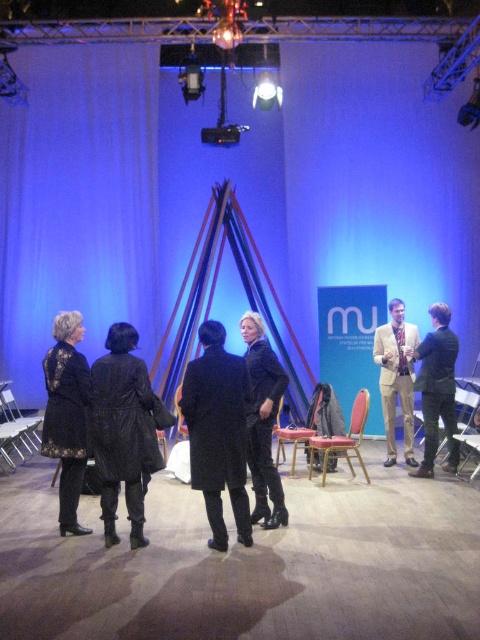
Question: Which of the following is the closest to the observer?

Choices:
 (A) metallic gold chair at center
 (B) black wool coat at center

Answer: (B)

Question: Does green fabric suit at right have a larger size compared to black leather chair at center?

Choices:
 (A) yes
 (B) no

Answer: (A)

Question: Considering the real-world distances, which object is farthest from the black wool coat at center?

Choices:
 (A) black lace coat at left
 (B) metallic silver chair at lower left
 (C) wooden chair at center
 (D) black leather chair at center

Answer: (B)

Question: Which point is farther to the camera?

Choices:
 (A) tan fabric suit at right
 (B) black lace coat at left
 (C) metallic gold chair at center
 (D) black wool coat at center

Answer: (A)

Question: Is tan fabric suit at right thinner than wooden chair at center?

Choices:
 (A) no
 (B) yes

Answer: (A)

Question: Is tan fabric suit at right positioned before black leather chair at center?

Choices:
 (A) no
 (B) yes

Answer: (B)